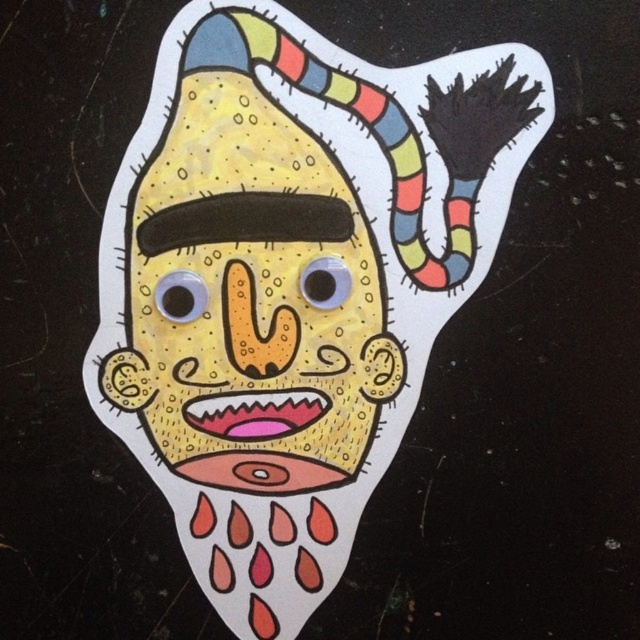
You are an artist drawing the cartoonish face. You want to add a new feature between the two points, point (376, 179) and point (204, 102). Which point should you start drawing from to ensure the new feature is in front?

You should start drawing from point (204, 102) because it is in front of point (376, 179), so starting there will place the new feature in front.

You are an artist trying to recreate the cartoonish face from the image. You want to place the matte yellow mask at center accurately. According to the coordinates provided, where should you position it on your canvas?

The matte yellow mask at center should be positioned at point coordinates (292, 282) on the canvas.